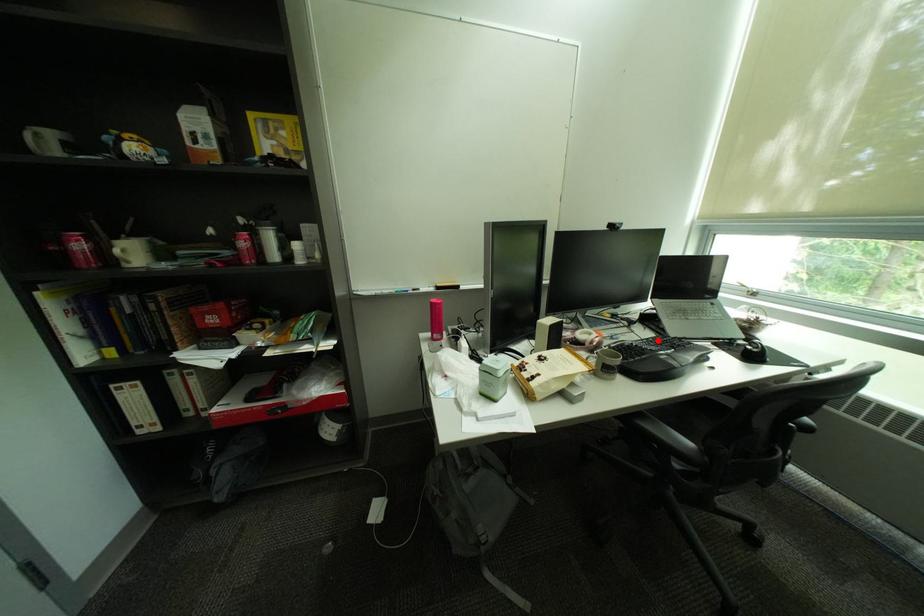
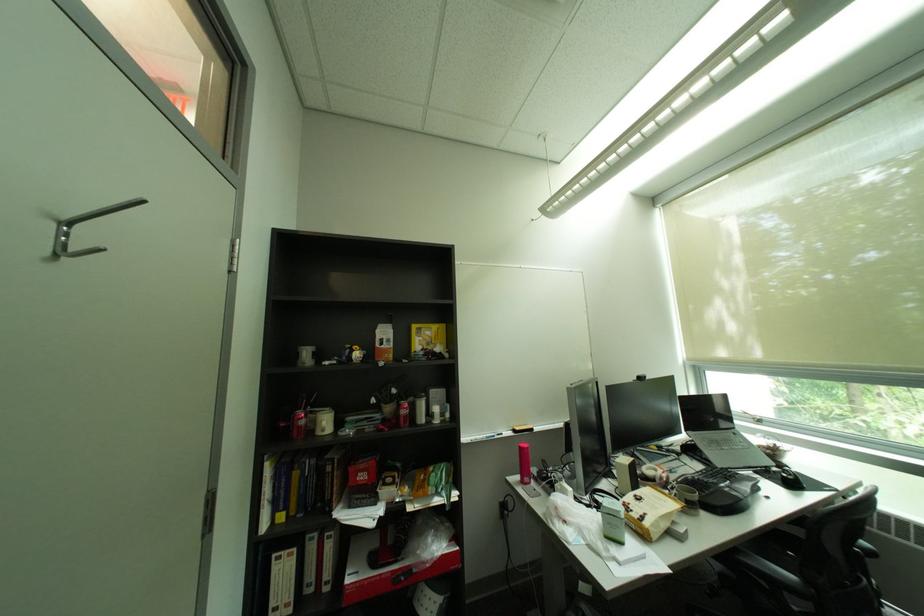
Find the pixel in the second image that matches the highlighted location in the first image.

(712, 472)